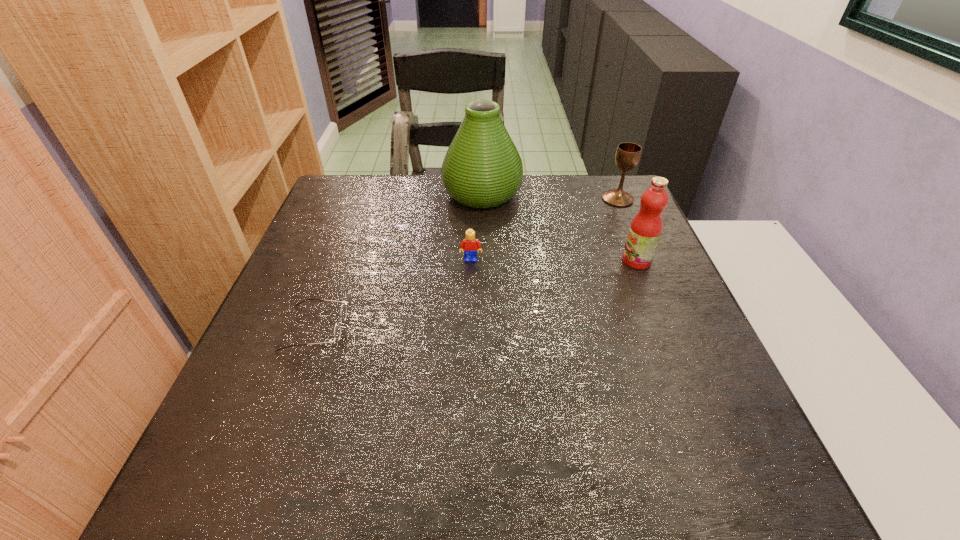
Find the location of a particular element. free space located 0.060m on the left of the third shortest object is located at coordinates (582, 199).

Identify the location of free region located 0.230m on the front-facing side of the fourth tallest object. Image resolution: width=960 pixels, height=540 pixels. (469, 336).

Identify the location of free space located 0.240m through the lenses of the shortest object. The height and width of the screenshot is (540, 960). (461, 328).

The image size is (960, 540). I want to click on vase situated at the far edge, so click(x=482, y=169).

Image resolution: width=960 pixels, height=540 pixels. What are the coordinates of `chalice situated at the far edge` in the screenshot? It's located at (627, 156).

Locate an element on the screen. object that is at the left edge is located at coordinates [337, 330].

Locate an element on the screen. The height and width of the screenshot is (540, 960). fruit juice that is at the right edge is located at coordinates (646, 227).

This screenshot has height=540, width=960. I want to click on chalice located at the right edge, so click(x=627, y=156).

In order to click on object present at the far right corner in this screenshot , I will do `click(627, 156)`.

This screenshot has height=540, width=960. I want to click on free location at the far edge of the desktop, so click(x=426, y=194).